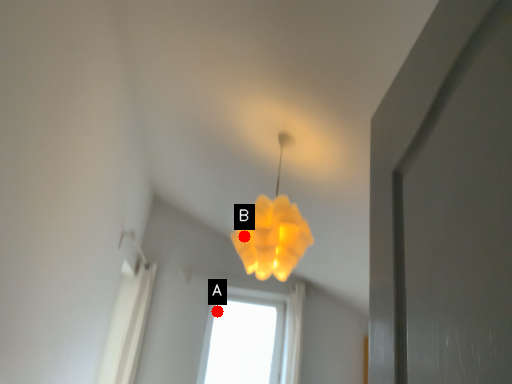
Question: Two points are circled on the image, labeled by A and B beside each circle. Which point is farther from the camera taking this photo?

Choices:
 (A) A is further
 (B) B is further

Answer: (A)